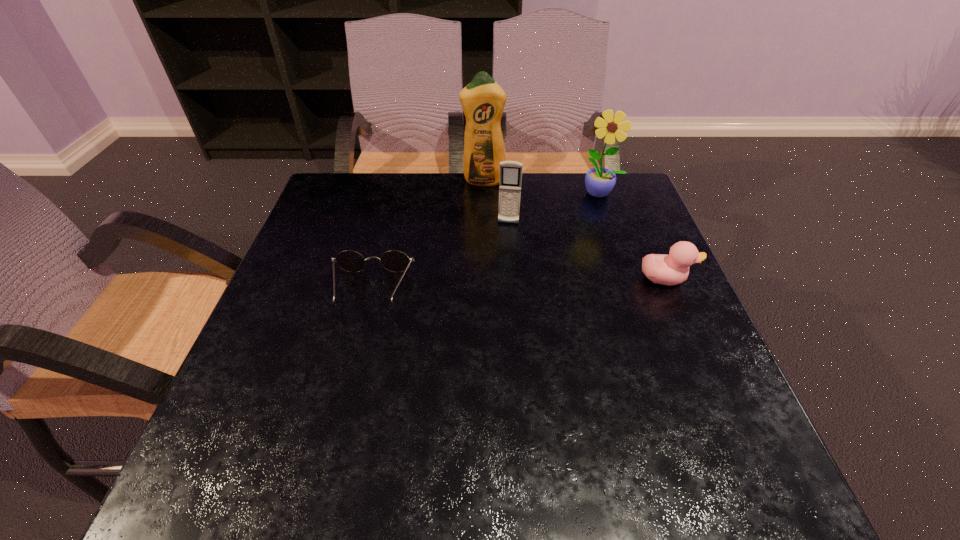
Where is `free space on the desktop that is between the spectacles and the duckling and is positioned on the front-facing side of the sunflower`? free space on the desktop that is between the spectacles and the duckling and is positioned on the front-facing side of the sunflower is located at coordinates (558, 283).

Find the location of a particular element. The width and height of the screenshot is (960, 540). vacant space on the desktop that is between the spectacles and the duckling and is positioned on the label of the detergent is located at coordinates (490, 286).

At what (x,y) coordinates should I click in order to perform the action: click on vacant space on the desktop that is between the spectacles and the fourth tallest object and is positioned on the front-facing side of the cellular telephone. Please return your answer as a coordinate pair (x, y). Image resolution: width=960 pixels, height=540 pixels. Looking at the image, I should click on (500, 285).